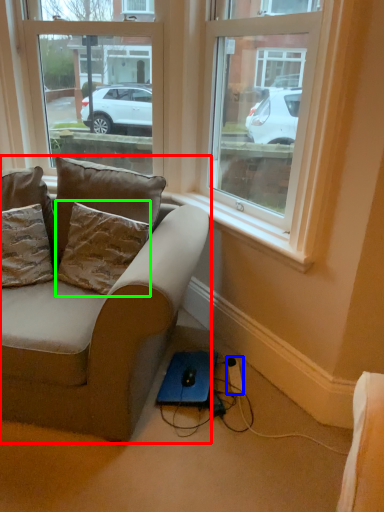
Question: Which object is the closest to the studio couch (highlighted by a red box)? Choose among these: extension cord (highlighted by a blue box) or pillow (highlighted by a green box).

Choices:
 (A) extension cord
 (B) pillow

Answer: (B)